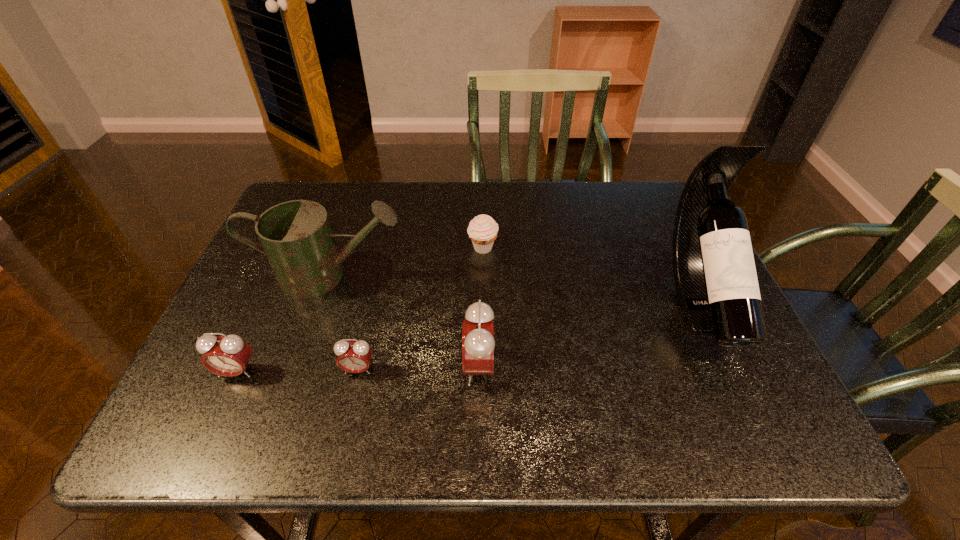
In the image, there is a desktop. Where is `free space at the far edge`? The image size is (960, 540). free space at the far edge is located at coordinates (570, 193).

The width and height of the screenshot is (960, 540). In the image, there is a desktop. In order to click on vacant space at the near edge in this screenshot , I will do `click(468, 393)`.

The image size is (960, 540). Identify the location of vacant space at the left edge of the desktop. (257, 340).

This screenshot has height=540, width=960. Find the location of `vacant space at the right edge of the desktop`. vacant space at the right edge of the desktop is located at coordinates tap(680, 301).

This screenshot has width=960, height=540. In the image, there is a desktop. Identify the location of vacant space at the far left corner. (321, 200).

At what (x,y) coordinates should I click in order to perform the action: click on vacant area at the far right corner of the desktop. Please return your answer as a coordinate pair (x, y). The width and height of the screenshot is (960, 540). Looking at the image, I should click on (618, 195).

Identify the location of vacant space that's between the rightmost alarm clock and the watering can. This screenshot has height=540, width=960. (404, 321).

Identify the location of vacant space that's between the rightmost object and the rightmost alarm clock. (588, 334).

You are a GUI agent. You are given a task and a screenshot of the screen. Output one action in this format:
    pyautogui.click(x=<x>, y=<y>)
    Task: Click on the vacant point located between the second alarm clock from left to right and the rightmost object
    
    Given the screenshot: What is the action you would take?
    pyautogui.click(x=529, y=335)

At what (x,y) coordinates should I click in order to perform the action: click on vacant region between the second alarm clock from right to left and the muffin. Please return your answer as a coordinate pair (x, y). Looking at the image, I should click on (420, 309).